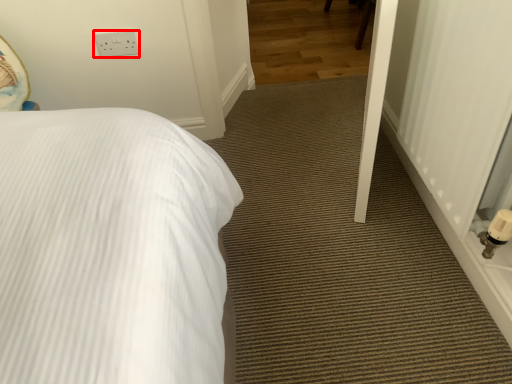
Question: Observing the image, what is the correct spatial positioning of electric outlet (annotated by the red box) in reference to screen door?

Choices:
 (A) left
 (B) right

Answer: (A)